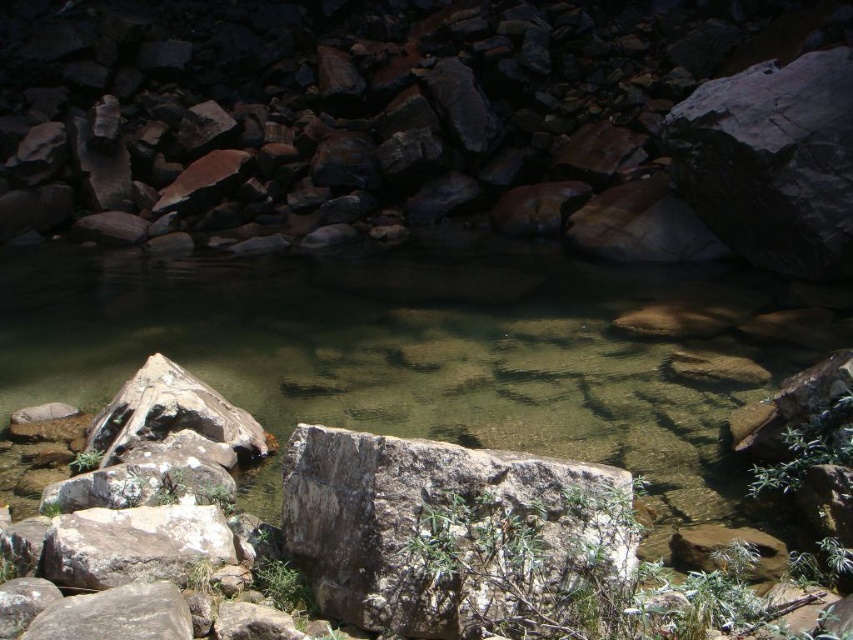
Between clear stone stream at center and gray rough rock at center, which one is positioned higher?

clear stone stream at center is higher up.

Who is more forward, (283, 278) or (410, 582)?

Point (410, 582) is in front.

Where is `clear stone stream at center`? clear stone stream at center is located at coordinates click(x=408, y=353).